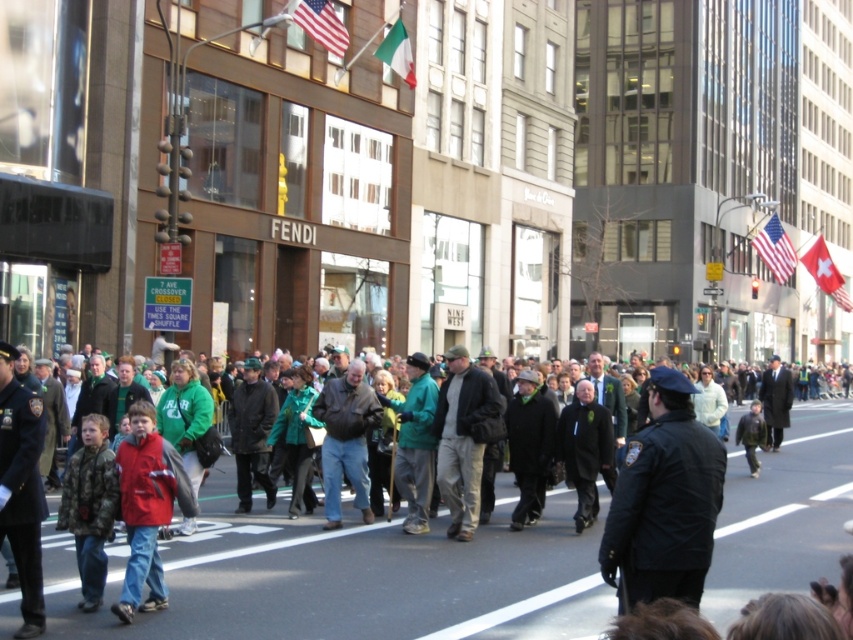
Question: Considering the real-world distances, which object is closest to the red matte jacket at center?

Choices:
 (A) green matte jacket at center
 (B) dark blue uniform at left
 (C) brown leather jacket at center

Answer: (B)

Question: Does green fabric crowd at center have a greater width compared to white fabric flag at upper right?

Choices:
 (A) yes
 (B) no

Answer: (A)

Question: Can you confirm if brown leather jacket at center is wider than american flag at upper right?

Choices:
 (A) no
 (B) yes

Answer: (A)

Question: Estimate the real-world distances between objects in this image. Which object is closer to the american flag at upper center?

Choices:
 (A) brown leather jacket at center
 (B) green matte jacket at center

Answer: (B)

Question: Which object is farther from the camera taking this photo?

Choices:
 (A) black uniformed officer at center
 (B) matte black jacket at center
 (C) camouflage jacket at lower left
 (D) white fabric flag at upper right

Answer: (D)

Question: Is matte black jacket at center further to the viewer compared to dark gray coat at center?

Choices:
 (A) no
 (B) yes

Answer: (A)